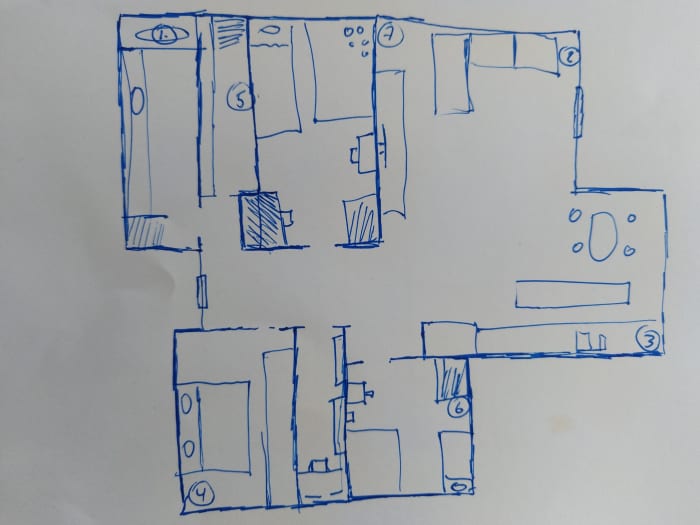
The width and height of the screenshot is (700, 525). I want to click on doorways, so click(x=323, y=242), click(x=377, y=360), click(x=316, y=327), click(x=197, y=217), click(x=223, y=192).